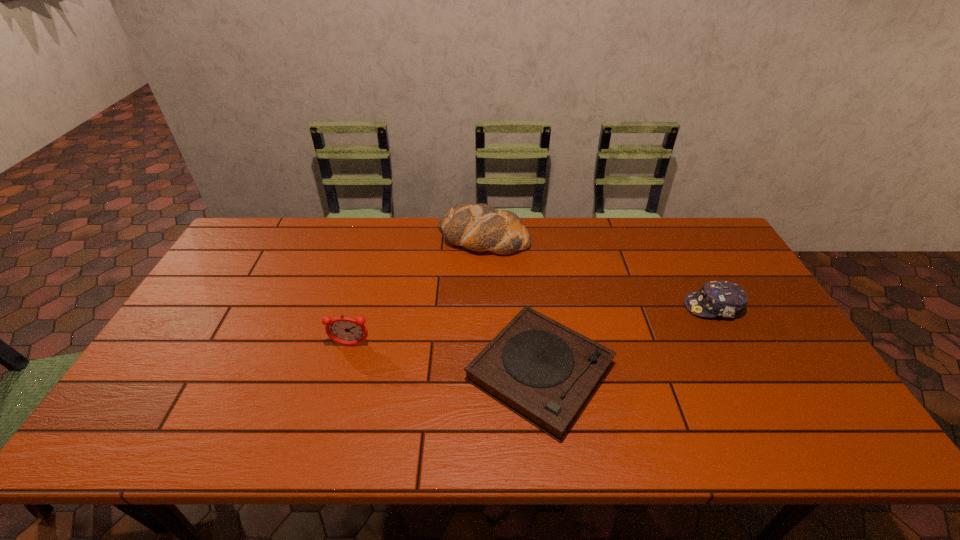
At what (x,y) coordinates should I click in order to perform the action: click on vacant area that lies between the phonograph record and the second shortest object. Please return your answer as a coordinate pair (x, y). The width and height of the screenshot is (960, 540). Looking at the image, I should click on (627, 339).

Locate an element on the screen. The image size is (960, 540). free point between the bread and the shortest object is located at coordinates pyautogui.click(x=512, y=306).

This screenshot has width=960, height=540. In order to click on blank region between the alarm clock and the shortest object in this screenshot , I will do `click(445, 359)`.

Where is `empty space between the phonograph record and the rightmost object`? empty space between the phonograph record and the rightmost object is located at coordinates (627, 339).

The image size is (960, 540). I want to click on free space that is in between the leftmost object and the bread, so click(x=418, y=292).

Identify which object is located as the nearest to the second shortest object. Please provide its 2D coordinates. Your answer should be formatted as a tuple, i.e. [(x, y)], where the tuple contains the x and y coordinates of a point satisfying the conditions above.

[(543, 371)]

Find the location of a particular element. This screenshot has width=960, height=540. the third closest object to the leftmost object is located at coordinates (725, 299).

Image resolution: width=960 pixels, height=540 pixels. Find the location of `free space that satisfies the following two spatial constraints: 1. on the front side of the bread; 2. on the right side of the shortest object`. free space that satisfies the following two spatial constraints: 1. on the front side of the bread; 2. on the right side of the shortest object is located at coordinates (485, 372).

Find the location of `free space that satisfies the following two spatial constraints: 1. on the front-facing side of the shortest object; 2. on the left side of the alarm clock`. free space that satisfies the following two spatial constraints: 1. on the front-facing side of the shortest object; 2. on the left side of the alarm clock is located at coordinates (344, 372).

Identify the location of free space that satisfies the following two spatial constraints: 1. on the front-facing side of the shortest object; 2. on the right side of the leftmost object. (344, 372).